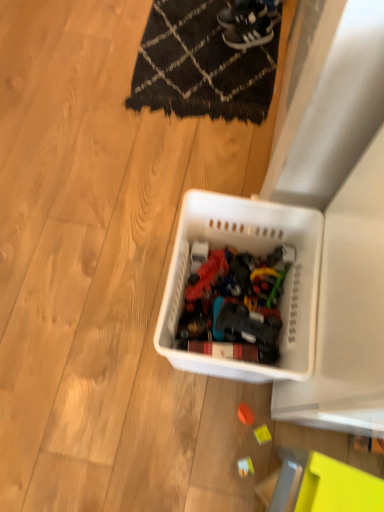
This screenshot has width=384, height=512. Identify the location of free region on the left part of yellow plastic toy at lower right, the second toy viewed from the top. (203, 432).